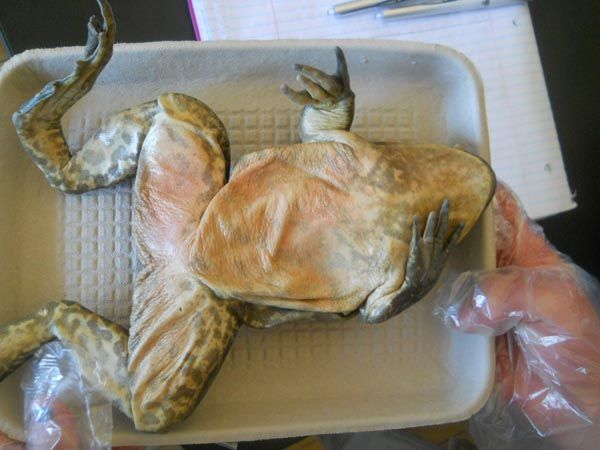
What are the coordinates of `table` in the screenshot? It's located at (161, 15).